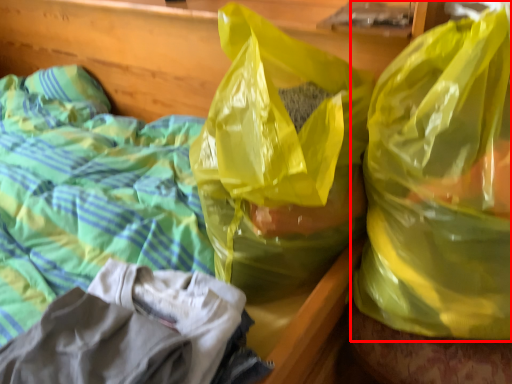
Question: Where is plastic bag (annotated by the red box) located in relation to plastic bag in the image?

Choices:
 (A) right
 (B) left

Answer: (A)